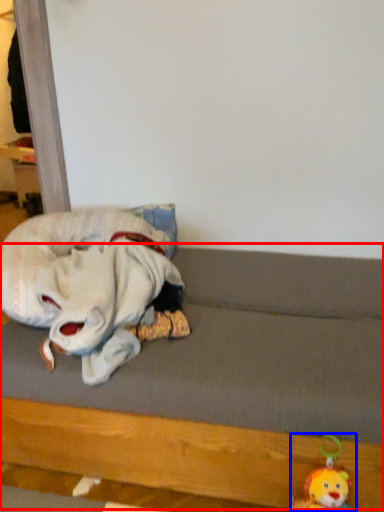
Question: Which point is closer to the camera, bed frame (highlighted by a red box) or toy (highlighted by a blue box)?

Choices:
 (A) bed frame
 (B) toy

Answer: (A)